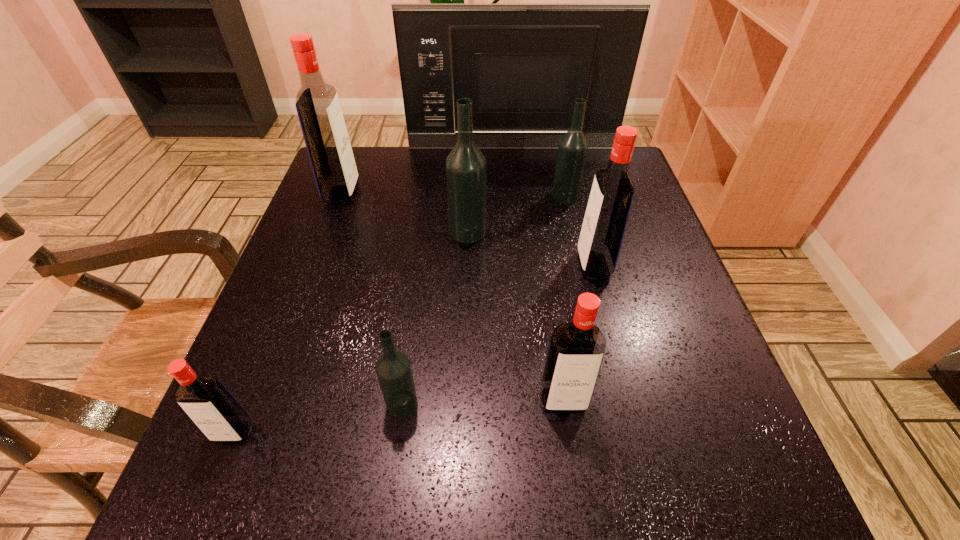
Find the location of `vacant space positioned on the front and back of the second biggest red vodka`. vacant space positioned on the front and back of the second biggest red vodka is located at coordinates point(554,265).

At what (x,y) coordinates should I click in order to perform the action: click on free region located on the front and back of the second biggest red vodka. Please return your answer as a coordinate pair (x, y). Looking at the image, I should click on (486, 265).

At what (x,y) coordinates should I click in order to perform the action: click on free location located 0.400m on the left of the farthest black vodka. Please return your answer as a coordinate pair (x, y). Image resolution: width=960 pixels, height=540 pixels. Looking at the image, I should click on (388, 196).

The height and width of the screenshot is (540, 960). What are the coordinates of `vacant area situated 0.150m on the front and back of the second red vodka from right to left` in the screenshot? It's located at (581, 523).

I want to click on blank area located 0.070m on the right of the smallest black vodka, so click(x=462, y=403).

Identify the location of vacant space positioned 0.060m on the front and back of the smallest red vodka. (211, 488).

Locate an element on the screen. Image resolution: width=960 pixels, height=540 pixels. microwave oven present at the far edge is located at coordinates (523, 66).

I want to click on microwave oven that is at the right edge, so click(523, 66).

I want to click on object present at the far left corner, so click(317, 103).

This screenshot has width=960, height=540. Identify the location of microwave oven present at the far right corner. (523, 66).